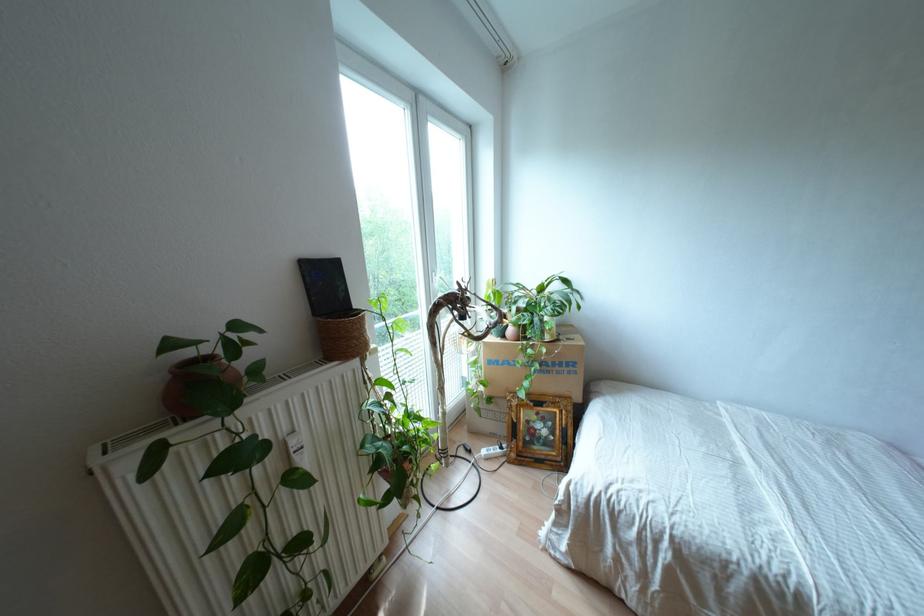
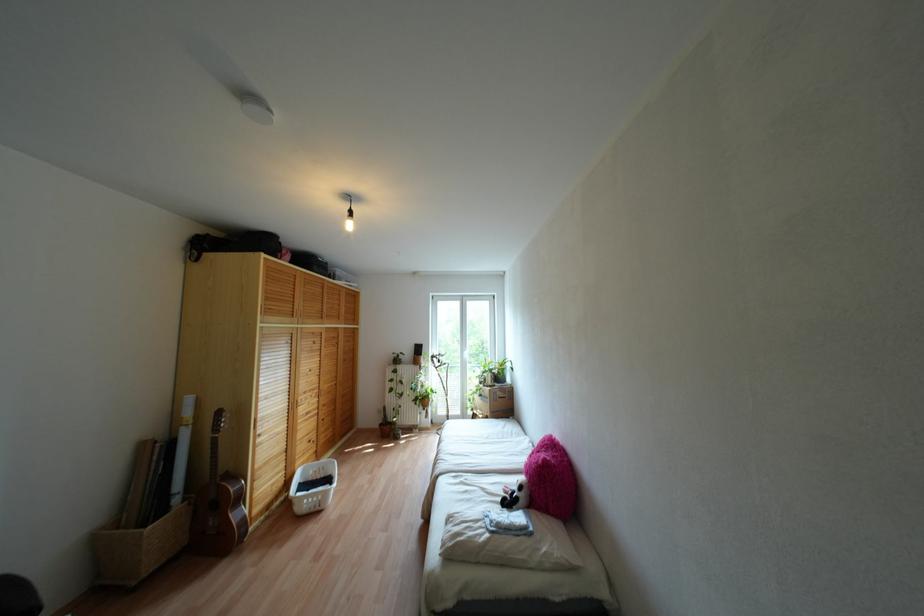
Find the pixel in the second image that matches point 407,415 in the first image.

(431, 389)